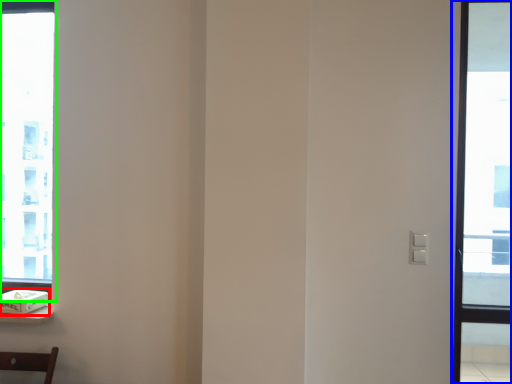
Question: Considering the real-world distances, which object is closest to box (highlighted by a red box)? window (highlighted by a blue box) or window (highlighted by a green box).

Choices:
 (A) window
 (B) window

Answer: (B)